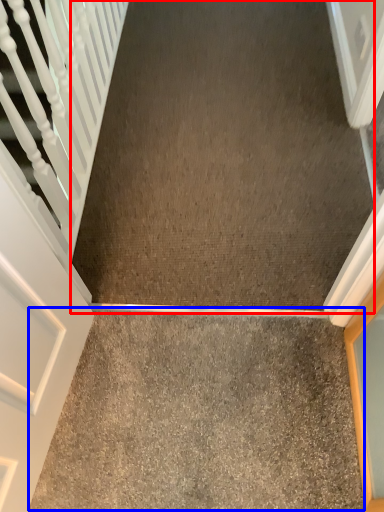
Question: Which point is further to the camera, concrete (highlighted by a red box) or concrete (highlighted by a blue box)?

Choices:
 (A) concrete
 (B) concrete

Answer: (A)